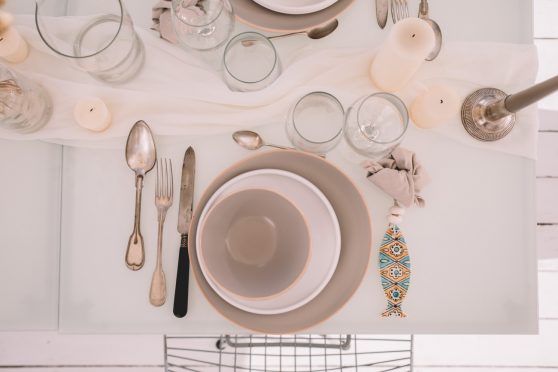
The width and height of the screenshot is (558, 372). I want to click on candles, so click(9, 47), click(91, 114), click(400, 49), click(424, 103).